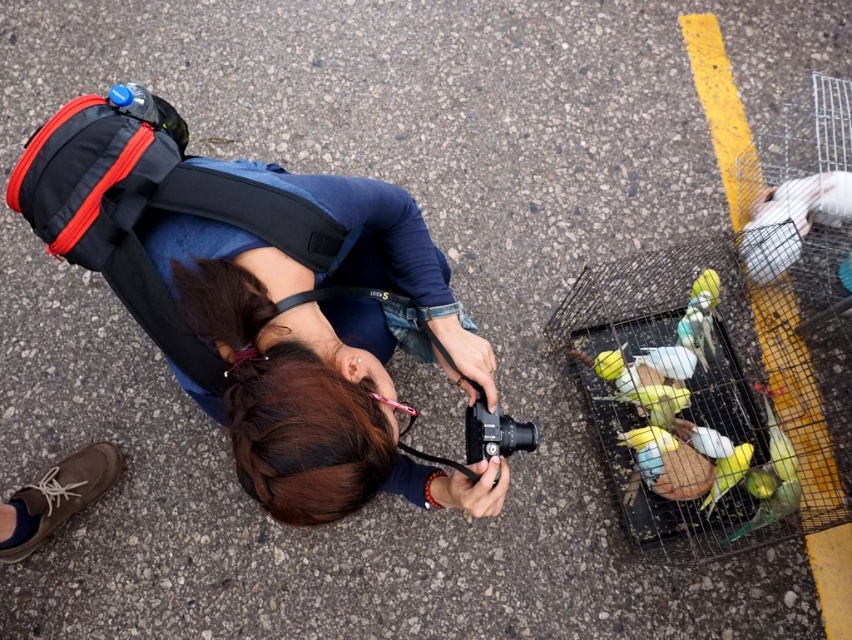
You are a photographer trying to capture the birds in the cage. Your backpack is at point (239,291). If you move 0.1 units to the right, will your backpack still be visible in the frame?

The point (239,291) corresponds to the matte black backpack at center. Moving 0.1 units to the right would shift the backpack out of the frame, so it would no longer be visible.